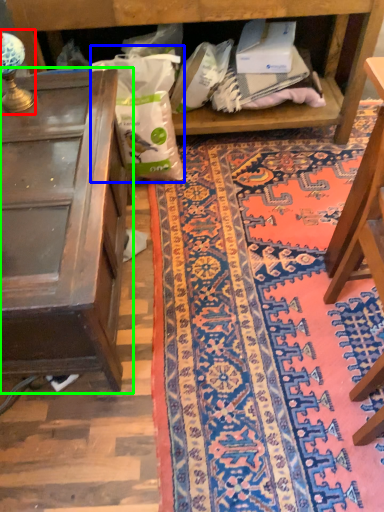
Question: Which object is the farthest from lamp (highlighted by a red box)? Choose among these: paper bag (highlighted by a blue box) or table (highlighted by a green box).

Choices:
 (A) paper bag
 (B) table

Answer: (A)